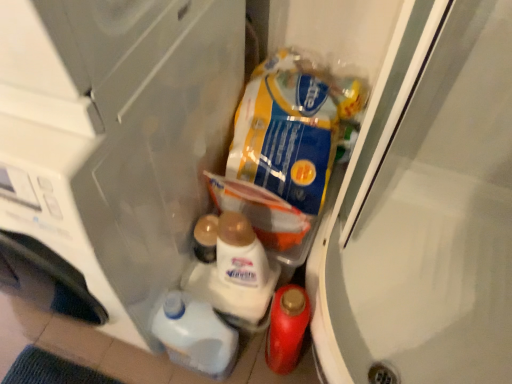
Question: Which direction should I rotate to look at white glossy lotion at center, the second snack from the top?

Choices:
 (A) right
 (B) left

Answer: (B)

Question: Can you confirm if white glossy liquid at lower center, placed as the third snack when sorted from top to bottom, is smaller than transparent plastic screen door at upper right?

Choices:
 (A) no
 (B) yes

Answer: (B)

Question: Is transparent plastic screen door at upper right completely or partially inside white glossy liquid at lower center, the first snack ordered from the bottom?

Choices:
 (A) yes
 (B) no

Answer: (B)

Question: Is white glossy liquid at lower center, placed as the third snack when sorted from top to bottom, in front of transparent plastic screen door at upper right?

Choices:
 (A) no
 (B) yes

Answer: (A)

Question: From a real-world perspective, is white glossy liquid at lower center, placed as the third snack when sorted from top to bottom, located beneath transparent plastic screen door at upper right?

Choices:
 (A) yes
 (B) no

Answer: (B)

Question: Are white glossy liquid at lower center, the first snack ordered from the bottom, and transparent plastic screen door at upper right far apart?

Choices:
 (A) no
 (B) yes

Answer: (A)

Question: Is white glossy liquid at lower center, the first snack ordered from the bottom, taller than transparent plastic screen door at upper right?

Choices:
 (A) no
 (B) yes

Answer: (B)

Question: Does white glossy lotion at center, the second snack from the top, have a lesser height compared to matte plastic bottle at lower right?

Choices:
 (A) no
 (B) yes

Answer: (B)

Question: Can you confirm if white glossy lotion at center, the second snack from the top, is thinner than matte plastic bottle at lower right?

Choices:
 (A) yes
 (B) no

Answer: (A)

Question: Is white glossy lotion at center, which is counted as the second snack, starting from the bottom, far away from matte plastic bottle at lower right?

Choices:
 (A) yes
 (B) no

Answer: (B)

Question: Is white glossy lotion at center, the second snack from the top, not within matte plastic bottle at lower right?

Choices:
 (A) yes
 (B) no

Answer: (A)

Question: Is white glossy lotion at center, the second snack from the top, directly adjacent to matte plastic bottle at lower right?

Choices:
 (A) no
 (B) yes

Answer: (A)

Question: Is white glossy lotion at center, which is counted as the second snack, starting from the bottom, to the right of matte plastic bottle at lower right from the viewer's perspective?

Choices:
 (A) no
 (B) yes

Answer: (A)

Question: Would you say transparent plastic container at lower center is outside white glossy liquid at lower center, placed as the third snack when sorted from top to bottom?

Choices:
 (A) yes
 (B) no

Answer: (A)